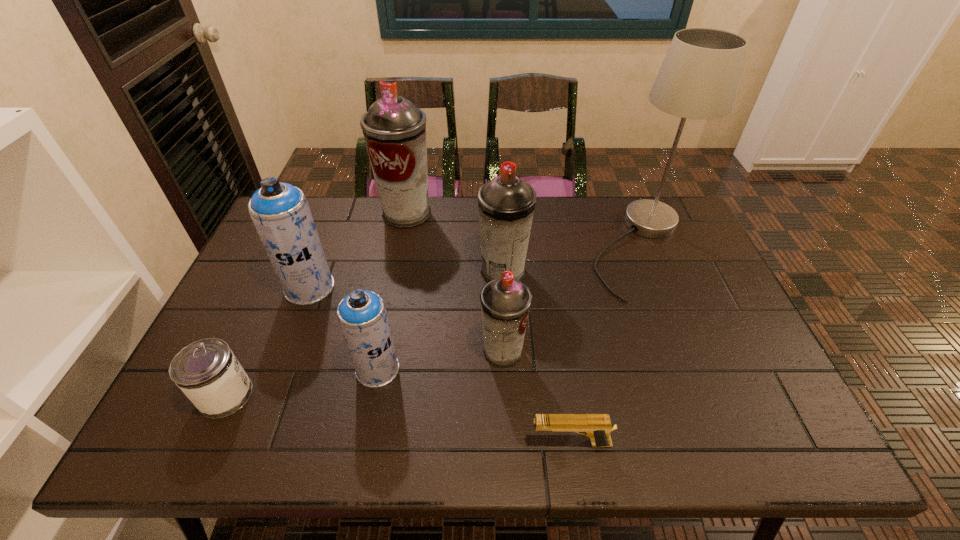
I want to click on free spot that satisfies the following two spatial constraints: 1. on the back side of the farther blue aerosol can; 2. on the left side of the tallest object, so click(324, 248).